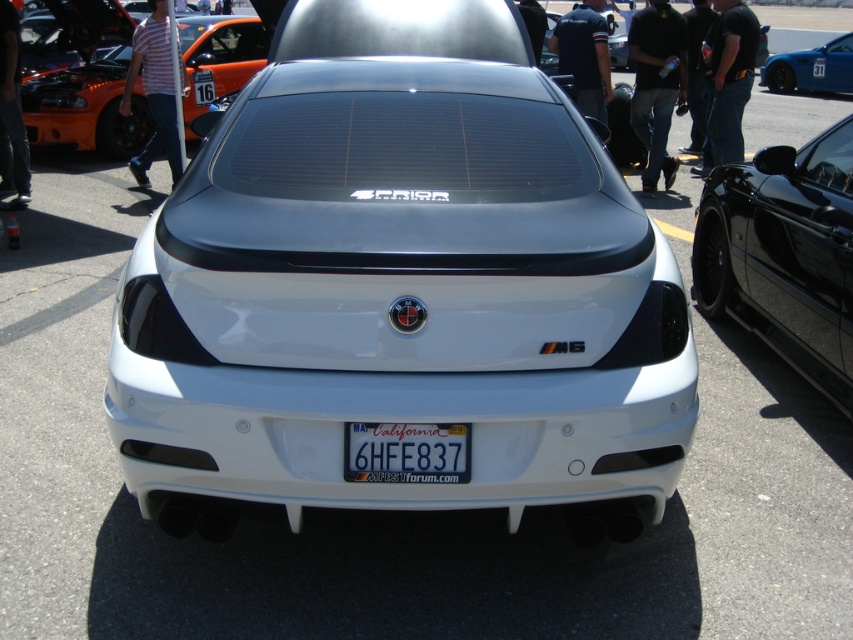
Question: Among these points, which one is nearest to the camera?

Choices:
 (A) (442, 456)
 (B) (339, 186)
 (C) (845, 312)

Answer: (A)

Question: Is orange matte sports car at upper left above blue glossy car at upper right?

Choices:
 (A) no
 (B) yes

Answer: (A)

Question: Which object is the farthest from the california blue metal license plate at center?

Choices:
 (A) orange matte sports car at upper left
 (B) black glossy car at right

Answer: (A)

Question: Which object is closer to the camera taking this photo?

Choices:
 (A) california blue metal license plate at center
 (B) blue glossy car at upper right

Answer: (A)

Question: Considering the relative positions of black glossy car at right and blue glossy car at upper right in the image provided, where is black glossy car at right located with respect to blue glossy car at upper right?

Choices:
 (A) above
 (B) below

Answer: (B)

Question: Can you confirm if black glossy car at right is bigger than orange matte sports car at upper left?

Choices:
 (A) yes
 (B) no

Answer: (B)